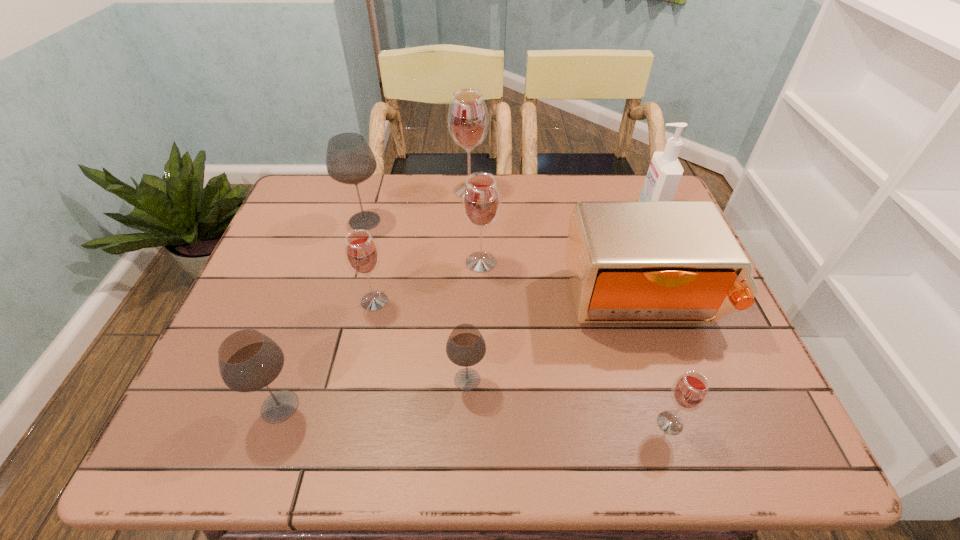
Locate which gray wineglass is the second closest to the biggest gray wineglass. Please provide its 2D coordinates. Your answer should be formatted as a tuple, i.e. [(x, y)], where the tuple contains the x and y coordinates of a point satisfying the conditions above.

[(248, 360)]

Where is `vacant space that satisfies the following two spatial constraints: 1. on the back side of the second smallest gray wineglass; 2. on the left side of the biggest red wineglass`? The width and height of the screenshot is (960, 540). vacant space that satisfies the following two spatial constraints: 1. on the back side of the second smallest gray wineglass; 2. on the left side of the biggest red wineglass is located at coordinates (353, 191).

This screenshot has width=960, height=540. I want to click on vacant space that satisfies the following two spatial constraints: 1. on the front side of the biggest red wineglass; 2. on the left side of the third nearest red wineglass, so click(x=468, y=262).